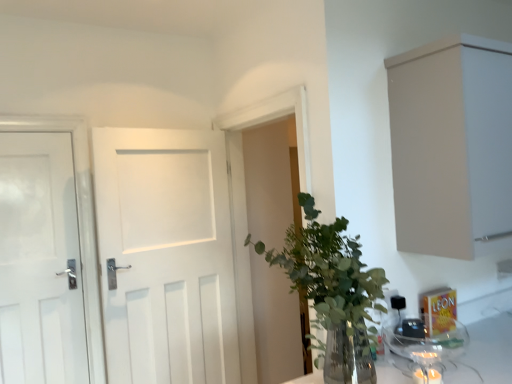
Find the location of a particular element. The width and height of the screenshot is (512, 384). white matte door at center, the second door when ordered from left to right is located at coordinates (166, 256).

This screenshot has width=512, height=384. What do you see at coordinates (40, 262) in the screenshot?
I see `white matte door at left, positioned as the first door in left-to-right order` at bounding box center [40, 262].

Locate an element on the screen. The height and width of the screenshot is (384, 512). beige matte cabinet at upper right is located at coordinates (452, 146).

Is point (395, 342) positioned after point (195, 223)?

No, (395, 342) is closer to viewer.

Is there a large distance between transparent glass jar at lower right and white matte door at center, the second door when ordered from left to right?

Yes.

Is transparent glass jar at lower right not within white matte door at center, the first door positioned from the right?

Indeed, transparent glass jar at lower right is completely outside white matte door at center, the first door positioned from the right.

What's the angular difference between transparent glass jar at lower right and white matte door at center, the first door positioned from the right,'s facing directions?

106 degrees.

Can you tell me how much white matte door at left, positioned as the first door in left-to-right order, and transparent glass jar at lower right differ in facing direction?

The facing directions of white matte door at left, positioned as the first door in left-to-right order, and transparent glass jar at lower right are 88.6 degrees apart.

Consider the image. Who is bigger, white matte door at left, positioned as the first door in left-to-right order, or transparent glass jar at lower right?

Bigger between the two is white matte door at left, positioned as the first door in left-to-right order.

Is white matte door at left, positioned as the first door in left-to-right order, not close to transparent glass jar at lower right?

Answer: Yes, white matte door at left, positioned as the first door in left-to-right order, and transparent glass jar at lower right are located far from each other.

Is point (68, 288) in front of point (439, 333)?

No, (68, 288) is behind (439, 333).

From the image's perspective, is green leafy plant at center located above or below transparent glass jar at lower right?

green leafy plant at center is situated higher than transparent glass jar at lower right in the image.

Who is bigger, green leafy plant at center or transparent glass jar at lower right?

Bigger between the two is green leafy plant at center.

Is green leafy plant at center placed right next to transparent glass jar at lower right?

green leafy plant at center and transparent glass jar at lower right are clearly separated.

Is beige matte cabinet at upper right at the right side of transparent glass jar at lower right?

Correct, you'll find beige matte cabinet at upper right to the right of transparent glass jar at lower right.

From a real-world perspective, which object rests below the other?

transparent glass jar at lower right, from a real-world perspective.

Considering the positions of points (400, 173) and (397, 338), is point (400, 173) closer to camera compared to point (397, 338)?

Yes.

Considering their positions, is beige matte cabinet at upper right located in front of or behind transparent glass jar at lower right?

Visually, beige matte cabinet at upper right is located behind transparent glass jar at lower right.

From the picture: Considering the relative positions of white matte door at left, which ranks as the 2th door in right-to-left order, and white matte door at center, the first door positioned from the right, in the image provided, is white matte door at left, which ranks as the 2th door in right-to-left order, to the left of white matte door at center, the first door positioned from the right, from the viewer's perspective?

Yes, white matte door at left, which ranks as the 2th door in right-to-left order, is to the left of white matte door at center, the first door positioned from the right.

Which object is wider, white matte door at left, positioned as the first door in left-to-right order, or white matte door at center, the first door positioned from the right?

white matte door at center, the first door positioned from the right.

Is the depth of white matte door at left, positioned as the first door in left-to-right order, less than that of white matte door at center, the first door positioned from the right?

No, it is behind white matte door at center, the first door positioned from the right.

Between point (19, 220) and point (137, 232), which one is positioned behind?

Positioned behind is point (137, 232).

Is transparent glass jar at lower right positioned far away from beige matte cabinet at upper right?

transparent glass jar at lower right is near beige matte cabinet at upper right, not far away.

Could you tell me if transparent glass jar at lower right is facing beige matte cabinet at upper right?

No, transparent glass jar at lower right is not oriented towards beige matte cabinet at upper right.

Is transparent glass jar at lower right surrounding beige matte cabinet at upper right?

No, beige matte cabinet at upper right is not surrounded by transparent glass jar at lower right.

Is point (32, 347) closer to camera compared to point (325, 356)?

No, (32, 347) is further to viewer.

Would you consider white matte door at left, positioned as the first door in left-to-right order, to be distant from green leafy plant at center?

white matte door at left, positioned as the first door in left-to-right order, is positioned a significant distance from green leafy plant at center.

From a real-world perspective, is white matte door at left, positioned as the first door in left-to-right order, on green leafy plant at center?

Yes.

Can you confirm if white matte door at left, which ranks as the 2th door in right-to-left order, is shorter than green leafy plant at center?

In fact, white matte door at left, which ranks as the 2th door in right-to-left order, may be taller than green leafy plant at center.

From a real-world perspective, starting from the transparent glass jar at lower right, which door is the 1st one vertically above it? Please provide its 2D coordinates.

[(166, 256)]

From the image's perspective, which door is the 2nd one above the transparent glass jar at lower right? Please provide its 2D coordinates.

[(40, 262)]

Which object lies nearer to the anchor point green leafy plant at center, transparent glass jar at lower right or white matte door at left, which ranks as the 2th door in right-to-left order?

transparent glass jar at lower right lies closer to green leafy plant at center than the other object.

From the image, which object appears to be farther from white matte door at left, positioned as the first door in left-to-right order, transparent glass jar at lower right or white matte door at center, the first door positioned from the right?

Among the two, transparent glass jar at lower right is located further to white matte door at left, positioned as the first door in left-to-right order.

Based on their spatial positions, is transparent glass jar at lower right or white matte door at left, positioned as the first door in left-to-right order, closer to white matte door at center, the first door positioned from the right?

Among the two, white matte door at left, positioned as the first door in left-to-right order, is located nearer to white matte door at center, the first door positioned from the right.

Considering their positions, is transparent glass jar at lower right positioned closer to white matte door at left, positioned as the first door in left-to-right order, than green leafy plant at center?

The object closer to white matte door at left, positioned as the first door in left-to-right order, is green leafy plant at center.

Considering their positions, is transparent glass jar at lower right positioned closer to white matte door at center, the first door positioned from the right, than beige matte cabinet at upper right?

The object closer to white matte door at center, the first door positioned from the right, is transparent glass jar at lower right.

Which object lies nearer to the anchor point beige matte cabinet at upper right, transparent glass jar at lower right or green leafy plant at center?

green leafy plant at center is positioned closer to the anchor beige matte cabinet at upper right.

Which object lies further to the anchor point white matte door at left, positioned as the first door in left-to-right order, transparent glass jar at lower right or beige matte cabinet at upper right?

beige matte cabinet at upper right.

Looking at the image, which one is located further to white matte door at left, which ranks as the 2th door in right-to-left order, green leafy plant at center or beige matte cabinet at upper right?

Based on the image, beige matte cabinet at upper right appears to be further to white matte door at left, which ranks as the 2th door in right-to-left order.

The width and height of the screenshot is (512, 384). I want to click on glass jar between white matte door at center, the second door when ordered from left to right, and beige matte cabinet at upper right from left to right, so click(426, 347).

Where is `houseplant between white matte door at center, the first door positioned from the right, and beige matte cabinet at upper right from left to right`? The image size is (512, 384). houseplant between white matte door at center, the first door positioned from the right, and beige matte cabinet at upper right from left to right is located at coordinates (332, 285).

The height and width of the screenshot is (384, 512). Find the location of `glass jar between green leafy plant at center and beige matte cabinet at upper right in the horizontal direction`. glass jar between green leafy plant at center and beige matte cabinet at upper right in the horizontal direction is located at coordinates (426, 347).

At what (x,y) coordinates should I click in order to perform the action: click on door between white matte door at left, positioned as the first door in left-to-right order, and transparent glass jar at lower right, in the horizontal direction. Please return your answer as a coordinate pair (x, y). This screenshot has width=512, height=384. Looking at the image, I should click on (166, 256).